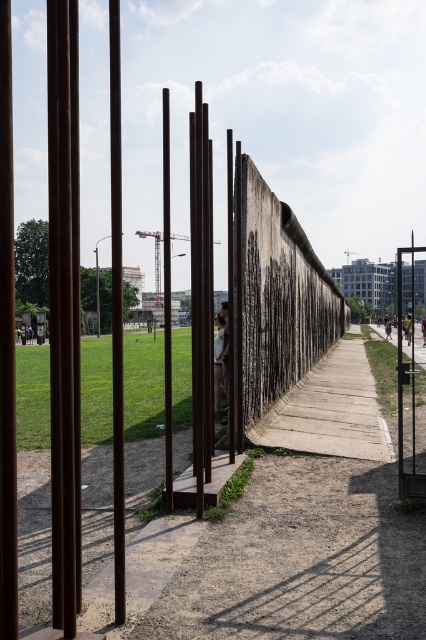
Question: Considering the real-world distances, which object is farthest from the smooth gray statue at center?

Choices:
 (A) rustic wood pole at center
 (B) smooth brown pole at center
 (C) rusty metal pole at left
 (D) weathered concrete wall at center

Answer: (C)

Question: Can you confirm if weathered concrete wall at center is positioned to the right of rustic wood pole at center?

Choices:
 (A) yes
 (B) no

Answer: (A)

Question: Estimate the real-world distances between objects in this image. Which object is closer to the rusty metal pole at left?

Choices:
 (A) smooth brown pole at center
 (B) smooth gray statue at center

Answer: (A)

Question: Which object is positioned farthest from the smooth brown pole at center?

Choices:
 (A) rustic wood pole at center
 (B) weathered concrete wall at center
 (C) smooth gray statue at center
 (D) rusty metal pole at left

Answer: (D)

Question: Is rustic wood pole at center wider than smooth brown pole at center?

Choices:
 (A) no
 (B) yes

Answer: (A)

Question: Does smooth brown pole at center have a lesser width compared to smooth gray statue at center?

Choices:
 (A) yes
 (B) no

Answer: (B)